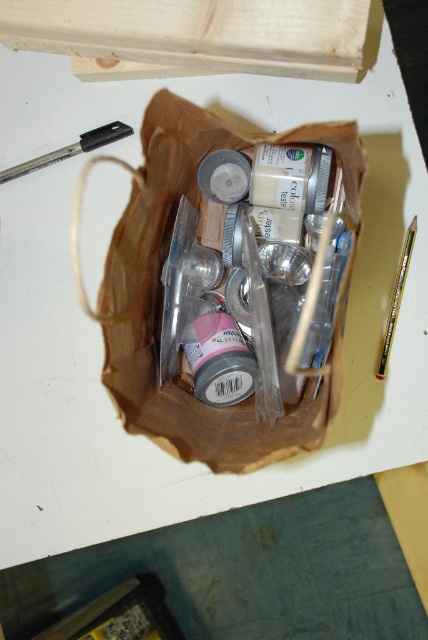
You are standing in front of the image and want to know how far the point at coordinates (226, 380) is from your camera. Can you determine the distance?

The point at coordinates (226, 380) is 38.55 inches away from the camera.

You need to place the matte pink plastic bottle at center and the metallic silver paint brush at right into a vertical storage container. Which object will require less vertical space?

The matte pink plastic bottle at center has a lesser height compared to the metallic silver paint brush at right, so it will require less vertical space.